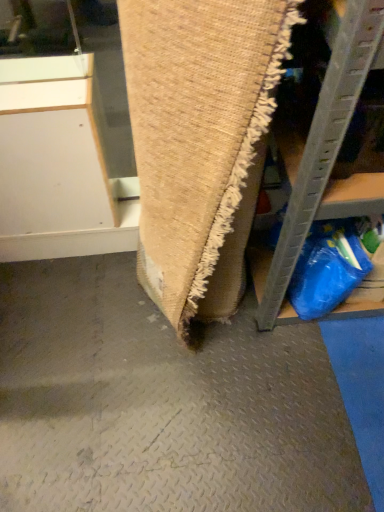
In order to face blue plastic bag at lower right, should I rotate leftwards or rightwards?

It's best to rotate right around 17.025 degrees.

Describe the element at coordinates (327, 269) in the screenshot. I see `blue plastic bag at lower right` at that location.

Locate an element on the screen. Image resolution: width=384 pixels, height=512 pixels. blue plastic bag at lower right is located at coordinates (327, 269).

Measure the distance between blue plastic bag at lower right and camera.

The distance of blue plastic bag at lower right from camera is 38.96 inches.

You are a GUI agent. You are given a task and a screenshot of the screen. Output one action in this format:
    pyautogui.click(x=<x>, y=<y>)
    Task: Click on the blue plastic bag at lower right
    This screenshot has height=512, width=384.
    Given the screenshot: What is the action you would take?
    pyautogui.click(x=327, y=269)